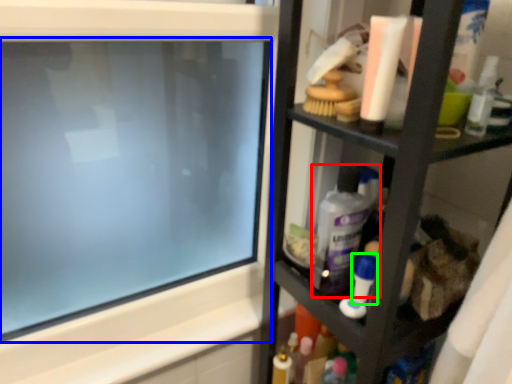
Question: Considering the real-world distances, which object is farthest from cleaning product (highlighted by a red box)? computer screen (highlighted by a blue box) or toiletry (highlighted by a green box)?

Choices:
 (A) computer screen
 (B) toiletry

Answer: (A)